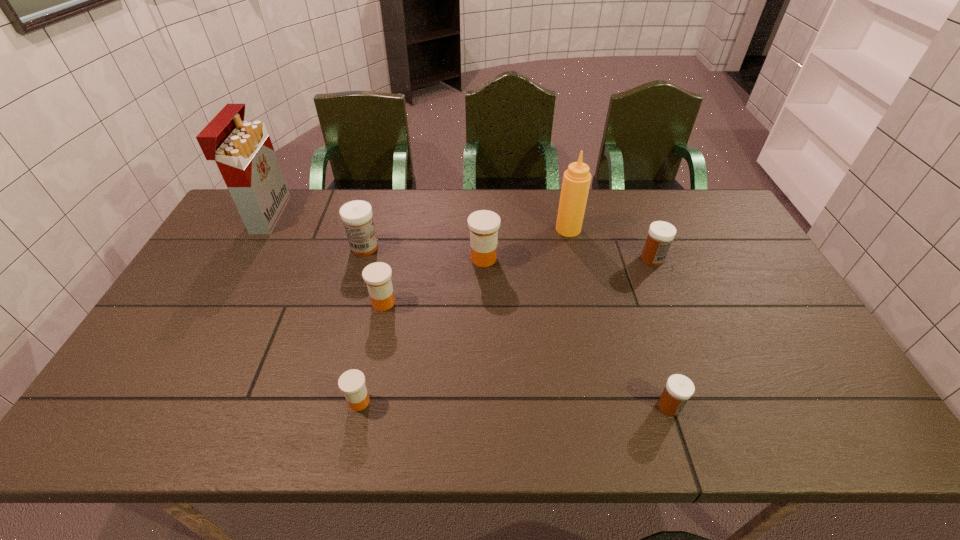
Identify which object is the second closest to the leftmost medicine. Please provide its 2D coordinates. Your answer should be formatted as a tuple, i.e. [(x, y)], where the tuple contains the x and y coordinates of a point satisfying the conditions above.

[(243, 151)]

Locate which object is the fourth closest to the tallest object. Please provide its 2D coordinates. Your answer should be formatted as a tuple, i.e. [(x, y)], where the tuple contains the x and y coordinates of a point satisfying the conditions above.

[(352, 382)]

The height and width of the screenshot is (540, 960). Find the location of `the fourth closest medicine to the tallest object`. the fourth closest medicine to the tallest object is located at coordinates (352, 382).

You are a GUI agent. You are given a task and a screenshot of the screen. Output one action in this format:
    pyautogui.click(x=<x>, y=<y>)
    Task: Click on the medicine that can be found as the second closest to the second farthest orange medicine
    This screenshot has width=960, height=540.
    Given the screenshot: What is the action you would take?
    pyautogui.click(x=483, y=224)

What are the coordinates of `orange medicine that is the closest one to the second nearest orange medicine` in the screenshot? It's located at (483, 224).

I want to click on the closest orange medicine to the smallest orange medicine, so click(x=377, y=276).

Identify the location of white medicine that is the closest to the seventh object from right to left. The height and width of the screenshot is (540, 960). (660, 234).

Identify which white medicine is the second nearest to the biggest orange medicine. Please provide its 2D coordinates. Your answer should be formatted as a tuple, i.e. [(x, y)], where the tuple contains the x and y coordinates of a point satisfying the conditions above.

[(660, 234)]

At what (x,y) coordinates should I click in order to perform the action: click on free point that satisfies the following two spatial constraints: 1. on the front side of the rightmost object; 2. on the label of the smallest orange medicine. Please return your answer as a coordinate pair (x, y). Image resolution: width=960 pixels, height=540 pixels. Looking at the image, I should click on (710, 402).

Locate an element on the screen. Image resolution: width=960 pixels, height=540 pixels. vacant region that satisfies the following two spatial constraints: 1. on the label of the smallest orange medicine; 2. on the right side of the smallest white medicine is located at coordinates (358, 406).